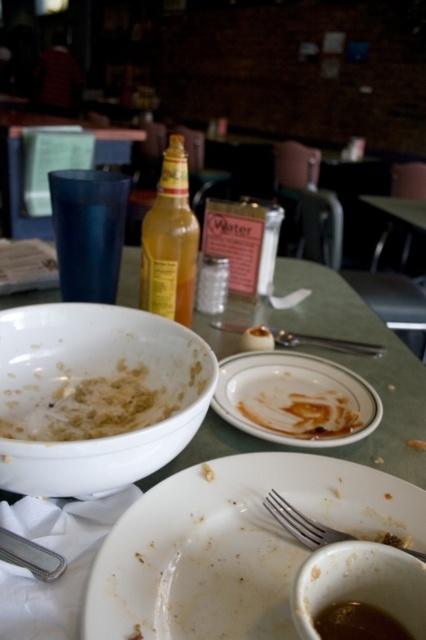
Question: Observing the image, what is the correct spatial positioning of green plastic table at center in reference to brown matte soup at lower center?

Choices:
 (A) left
 (B) right

Answer: (A)

Question: Based on their relative distances, which object is nearer to the brown matte soup at lower center?

Choices:
 (A) white matte bowl at lower left
 (B) white matte bowl at center
 (C) green plastic table at center

Answer: (A)

Question: Is brown matte soup at lower center further to camera compared to silver metallic fork at lower center?

Choices:
 (A) no
 (B) yes

Answer: (A)

Question: Which of these objects is positioned closest to the white matte plate at center?

Choices:
 (A) green plastic table at center
 (B) white matte bowl at center

Answer: (B)

Question: Which point appears closest to the camera in this image?

Choices:
 (A) (399, 499)
 (B) (362, 611)

Answer: (B)

Question: Does white glossy plate at center appear on the left side of brown matte bowl at lower center?

Choices:
 (A) yes
 (B) no

Answer: (B)